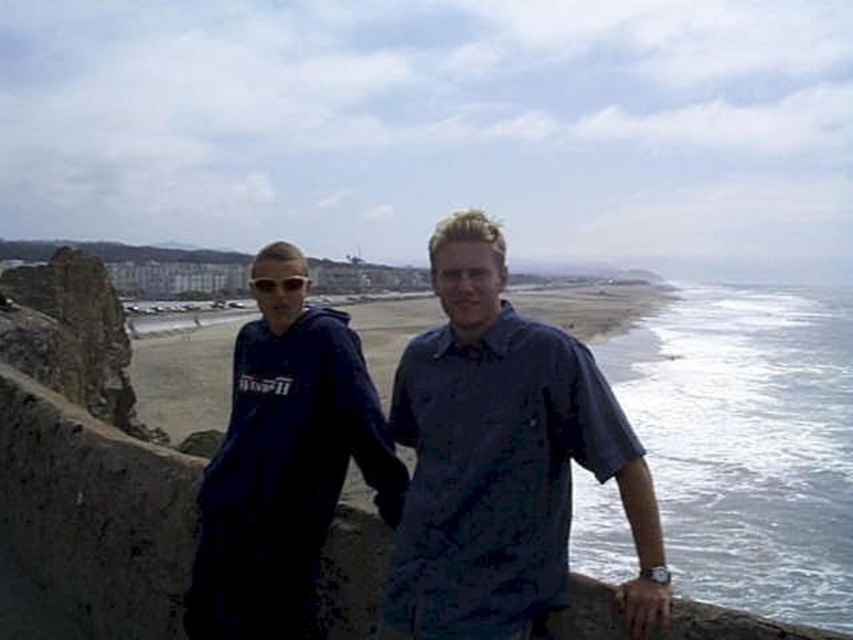
Is blue fabric shirt at center smaller than matte blue hoodie at left?

Yes.

Can you confirm if blue fabric shirt at center is wider than matte blue hoodie at left?

In fact, blue fabric shirt at center might be narrower than matte blue hoodie at left.

At what (x,y) coordinates should I click in order to perform the action: click on blue fabric shirt at center. Please return your answer as a coordinate pair (x, y). The image size is (853, 640). Looking at the image, I should click on (502, 460).